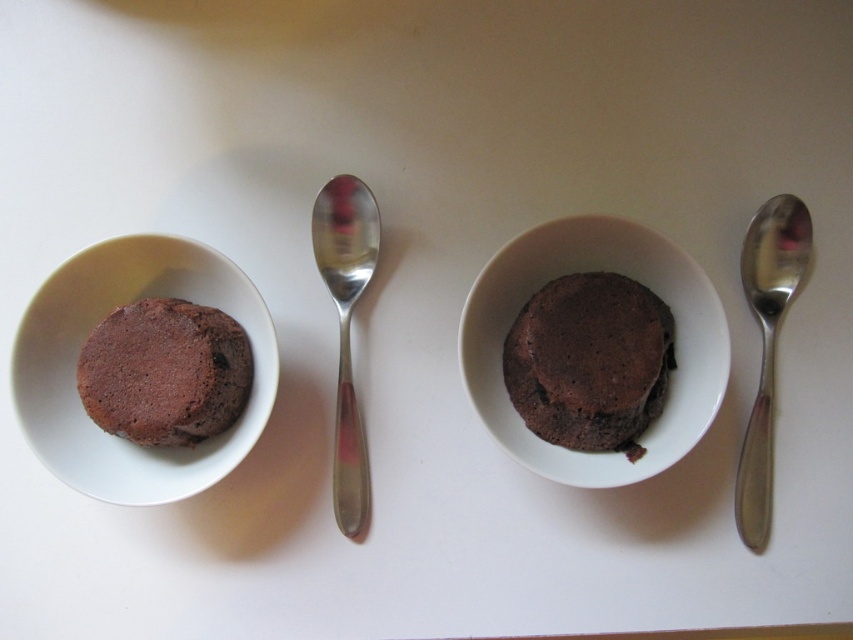
Is matte ceramic bowl at left closer to camera compared to matte ceramic bowl at center?

Yes.

Identify the location of matte ceramic bowl at left. (86, 337).

Which is behind, point (91, 332) or point (753, 438)?

The point (753, 438) is behind.

Identify the location of chocolate matte cake at left. (165, 372).

Is matte ceramic bowl at left further to the viewer compared to chocolate matte cake at left?

No.

Between matte ceramic bowl at left and chocolate matte cake at left, which one has more height?

With more height is matte ceramic bowl at left.

Identify the location of matte ceramic bowl at left. The height and width of the screenshot is (640, 853). (86, 337).